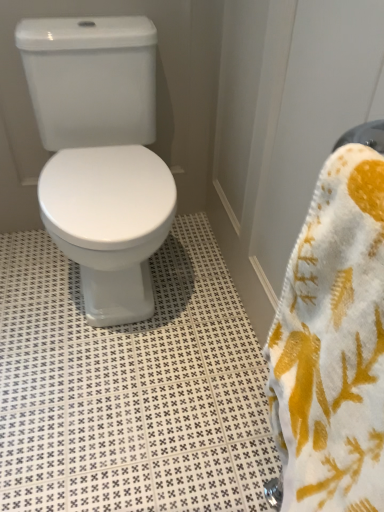
The height and width of the screenshot is (512, 384). I want to click on vacant point above white textured tile at center (from a real-world perspective), so click(112, 355).